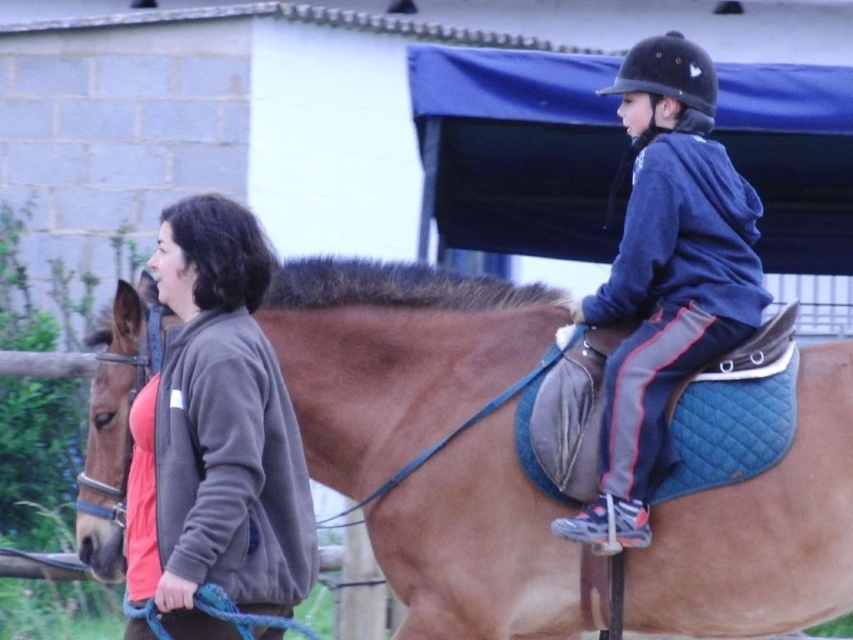
You are a photographer trying to capture a photo of the blue fleece jacket at upper right and the brown leather saddle at upper right. From the perspective of the photographer standing in front of the scene, which object should you adjust your camera to focus on first if you want to include both in the frame without moving your position?

The brown leather saddle at upper right should be focused on first because it is positioned to the left of the blue fleece jacket at upper right, allowing the photographer to capture both objects in the frame by adjusting the camera to start from the left side.

You are a photographer trying to capture a clear shot of the brown leather saddle at upper right. There is a point at coordinates (x=393, y=356) that you need to focus on. Based on the scene description, is this point likely part of the saddle?

Yes, the point at coordinates (x=393, y=356) is on the brown leather saddle at upper right, so it is part of the saddle.

You are a photographer setting up a shoot in the scene. You need to place a small tripod between the brown leather saddle at upper right and the blue fleece jacket at upper right. Which object should you place the tripod closer to if you want it to be near the larger object?

The brown leather saddle at upper right is bigger than the blue fleece jacket at upper right, so you should place the tripod closer to the brown leather saddle at upper right.